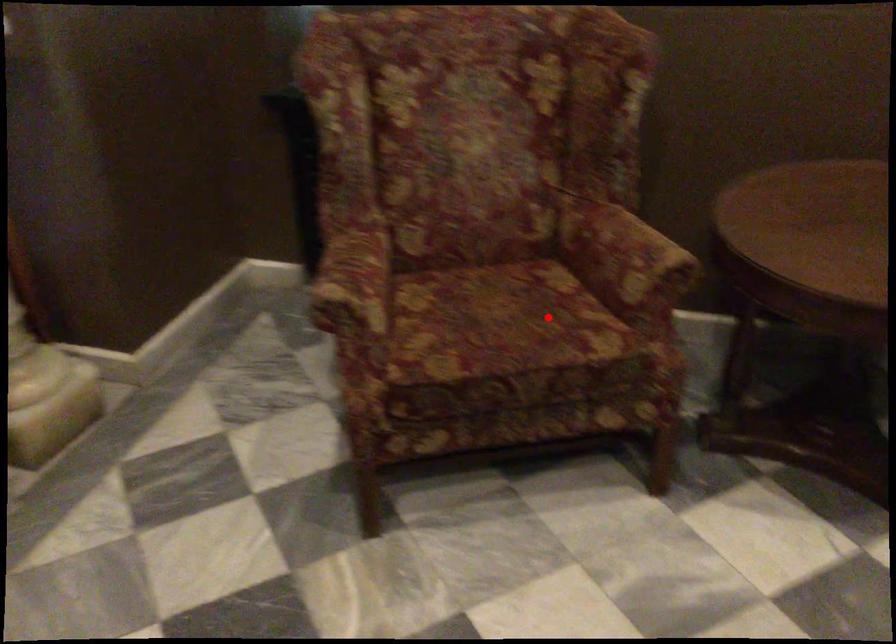
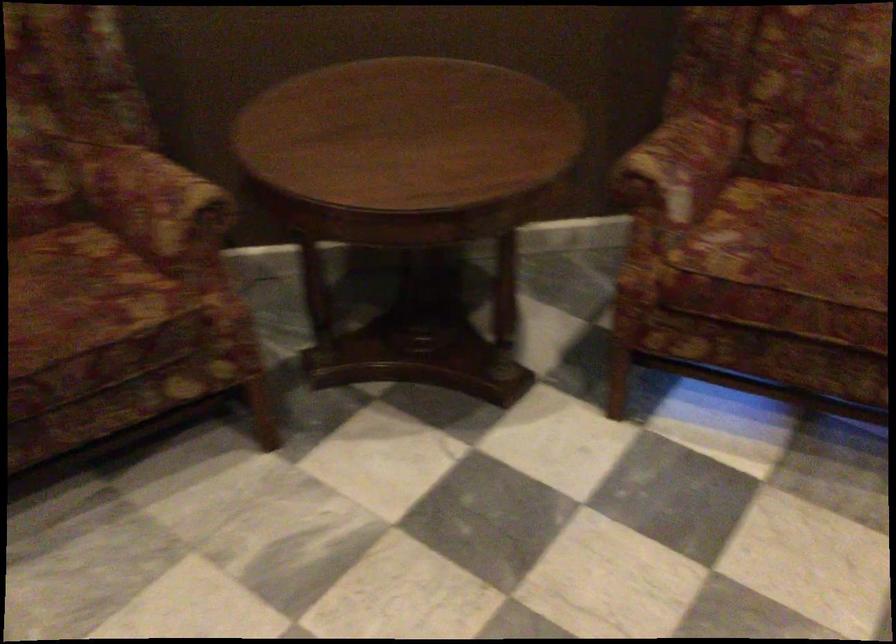
Question: I am providing you with two images of the same scene from different viewpoints. A red point is shown in image1. For the corresponding object point in image2, is it positioned nearer or farther from the camera?

Choices:
 (A) Nearer
 (B) Farther

Answer: (A)